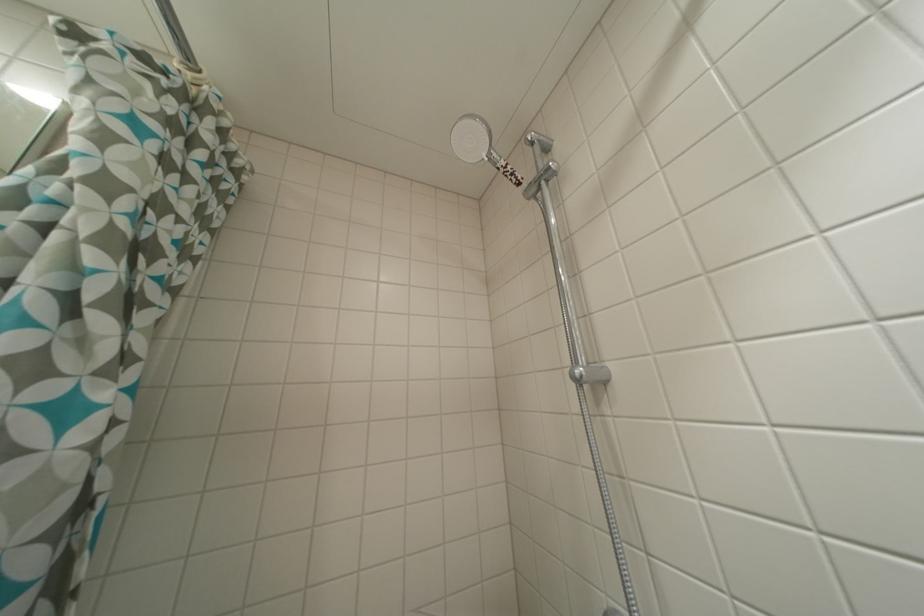
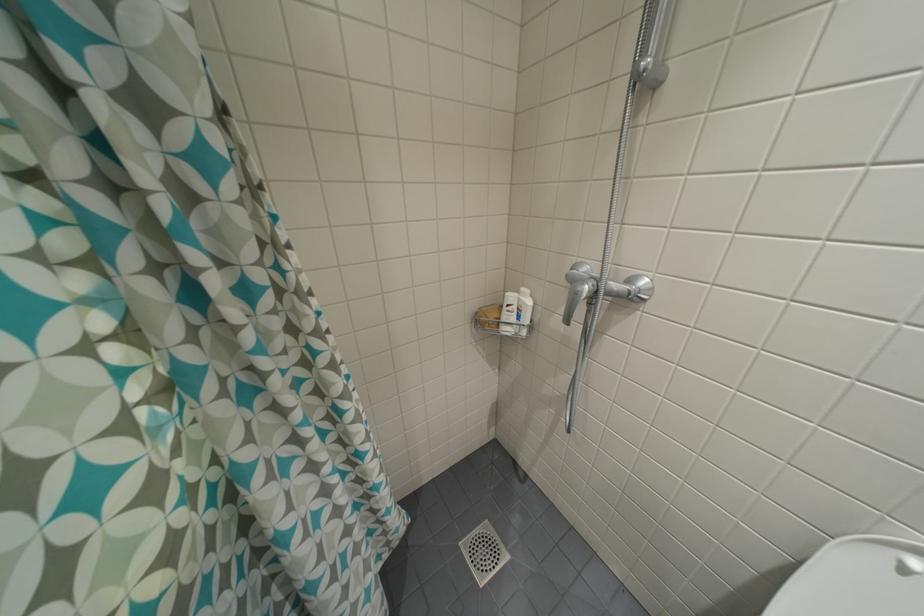
Question: Based on the continuous images, in which direction is the camera rotating? Reply with the corresponding letter.

Choices:
 (A) Left
 (B) Right
 (C) Up
 (D) Down

Answer: (D)